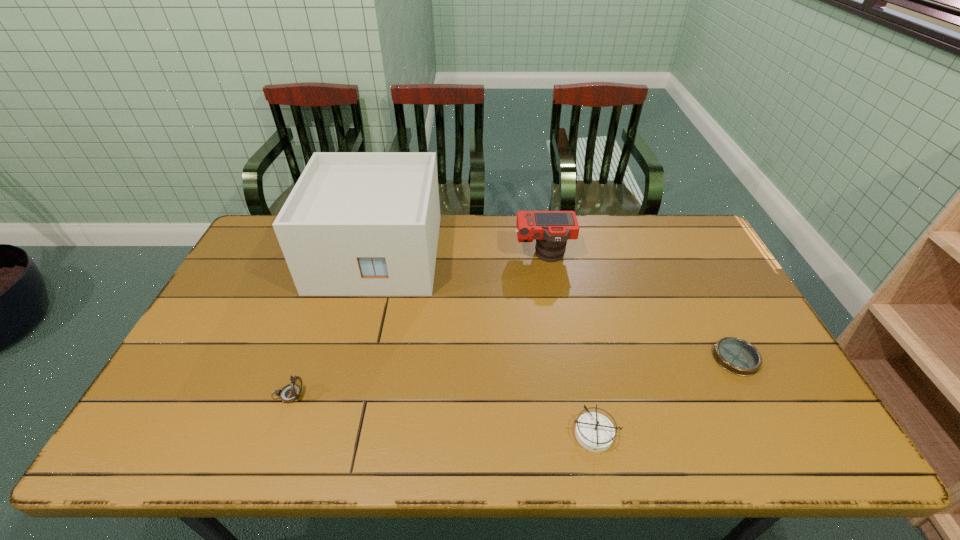
At what (x,y) coordinates should I click in order to perform the action: click on the tallest object. Please return your answer as a coordinate pair (x, y). The width and height of the screenshot is (960, 540). Looking at the image, I should click on (356, 223).

The image size is (960, 540). I want to click on the second tallest object, so click(551, 229).

Where is `the second nearest object`? the second nearest object is located at coordinates [x=290, y=393].

Locate an element on the screen. The width and height of the screenshot is (960, 540). the second nearest compass is located at coordinates (290, 393).

The width and height of the screenshot is (960, 540). I want to click on the second shortest object, so click(x=595, y=432).

Image resolution: width=960 pixels, height=540 pixels. In order to click on the nearest compass in this screenshot , I will do `click(595, 432)`.

Where is `the rightmost object`? The image size is (960, 540). the rightmost object is located at coordinates (737, 356).

Identify the location of the third farthest object. (737, 356).

What are the coordinates of `vacant space located on the side of the box with the window` in the screenshot? It's located at click(344, 379).

The image size is (960, 540). What are the coordinates of `vacant region located on the back of the fourth shortest object` in the screenshot? It's located at 538,219.